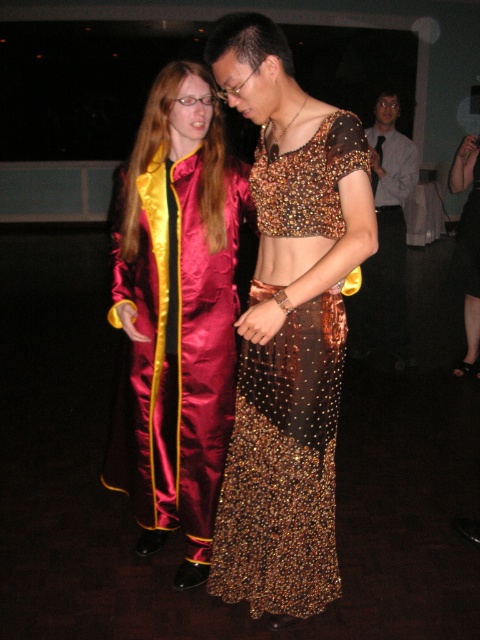
You are at the entrance of the event and want to locate the shiny satin suit at center. Based on the coordinates provided, in which direction should you move to find it?

The shiny satin suit at center is located at coordinates point (288, 328), so you should move towards the center of the image to find it.

You are a photographer at a social event and need to capture both the shiny gold shirt at center and the gold sequined dress at center in a single frame. Which object should you focus on first to ensure both are in the frame?

The shiny gold shirt at center is taller than the gold sequined dress at center, so you should focus on the shiny gold shirt at center first to ensure both are in the frame.